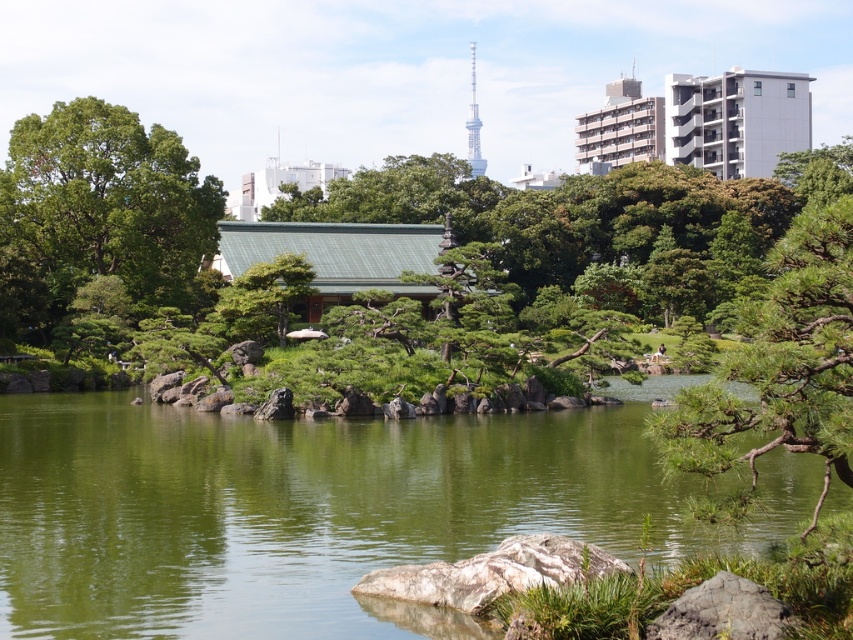
You are standing at the origin point in the Japanese garden scene. There are two points marked in the image, point A at coordinates point A is point (x=393, y=588) and point B at point B is point (x=775, y=628). Which point is closer to you?

Point B at point (x=775, y=628) is closer to you because it is in front of point A at point (x=393, y=588), which is behind it.

You are a landscape architect designing a garden. You have to place a large decorative stone in the scene. Given the green smooth water at center and the green textured tree at center, which object should the stone be placed closer to if you want it to be more noticeable?

The stone should be placed closer to the green textured tree at center because the green smooth water at center is larger in size, so placing the stone near the smaller tree would make it stand out more against the larger water area.